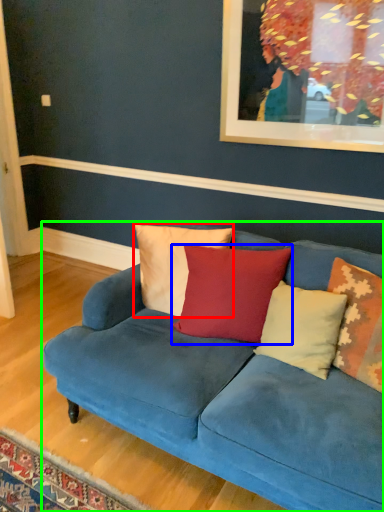
Question: Which object is the farthest from pillow (highlighted by a red box)? Choose among these: pillow (highlighted by a blue box) or studio couch (highlighted by a green box).

Choices:
 (A) pillow
 (B) studio couch

Answer: (B)